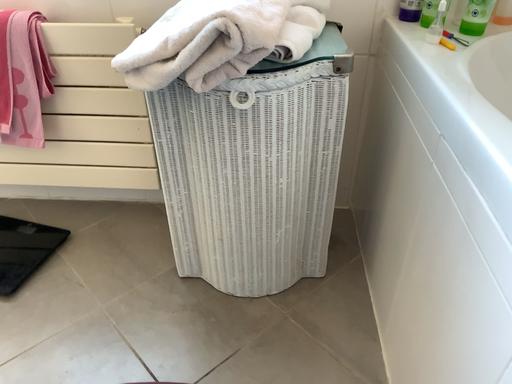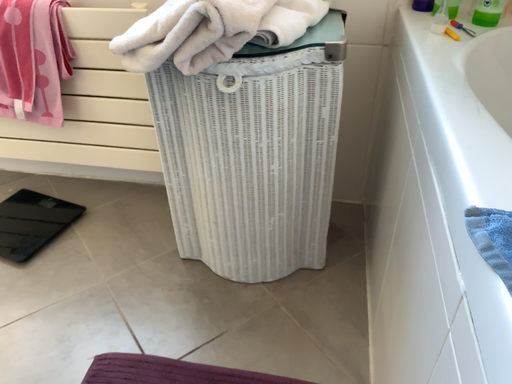
Question: Which way did the camera rotate in the video?

Choices:
 (A) rotated right
 (B) rotated left

Answer: (B)